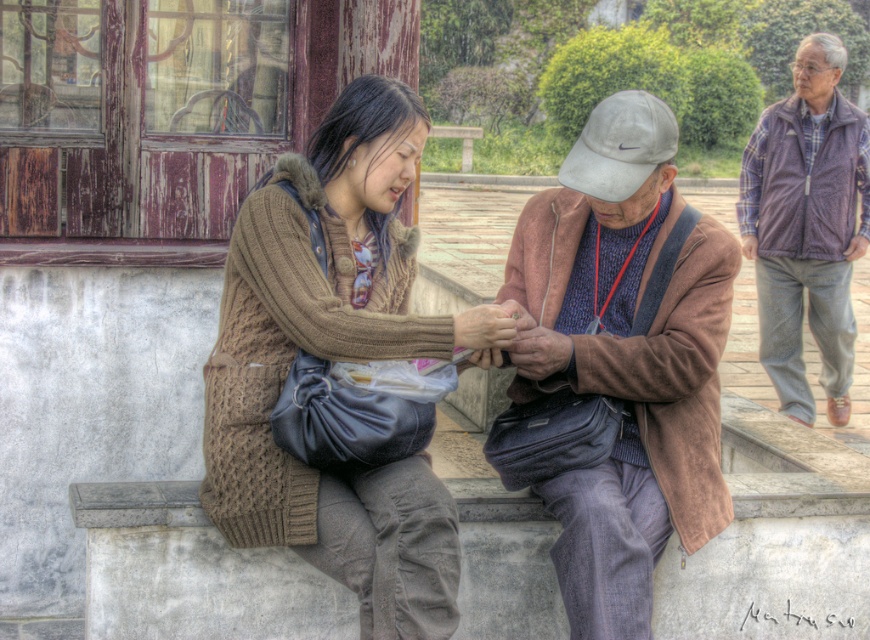
Question: Is purple fleece vest at upper right positioned in front of white suede baseball cap at center?

Choices:
 (A) no
 (B) yes

Answer: (A)

Question: Can you confirm if brown knitted sweater at center is positioned above white suede baseball cap at center?

Choices:
 (A) yes
 (B) no

Answer: (B)

Question: Which point appears closest to the camera in this image?

Choices:
 (A) (757, 124)
 (B) (591, 141)

Answer: (B)

Question: Is brown suede jacket at center positioned before purple fleece vest at upper right?

Choices:
 (A) yes
 (B) no

Answer: (A)

Question: Which of the following is the closest to the observer?

Choices:
 (A) (634, 179)
 (B) (668, 173)

Answer: (A)

Question: Which object is positioned closest to the white suede baseball cap at center?

Choices:
 (A) brown knitted sweater at center
 (B) brown suede jacket at center
 (C) purple fleece vest at upper right

Answer: (B)